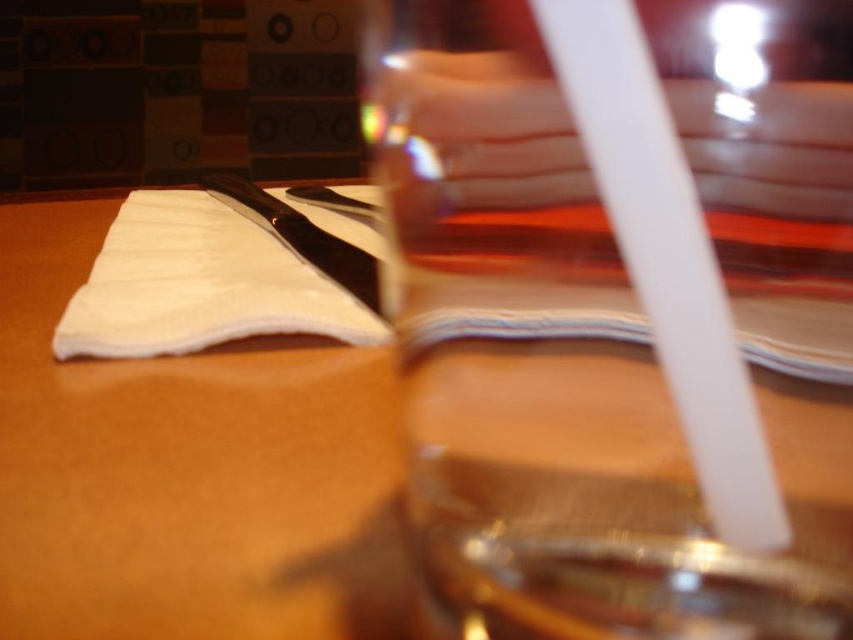
Based on the photo, does transparent glass at center appear on the left side of white fabric at center?

In fact, transparent glass at center is to the right of white fabric at center.

Which is more to the right, transparent glass at center or white fabric at center?

Positioned to the right is transparent glass at center.

Does point (543, 465) lie in front of point (242, 248)?

Yes, it is in front of point (242, 248).

Where is `transparent glass at center`? The image size is (853, 640). transparent glass at center is located at coordinates (561, 372).

Is wooden table at center positioned in front of polished metal knife at center?

Yes, wooden table at center is in front of polished metal knife at center.

Between point (18, 468) and point (280, 208), which one is positioned behind?

Positioned behind is point (280, 208).

Looking at this image, who is more distant from viewer, [178,516] or [235,177]?

The point [235,177] is behind.

Locate an element on the screen. wooden table at center is located at coordinates (189, 472).

Can you confirm if wooden table at center is positioned to the left of white fabric at center?

Indeed, wooden table at center is positioned on the left side of white fabric at center.

Which is in front, point (845, 394) or point (160, 300)?

Positioned in front is point (845, 394).

Image resolution: width=853 pixels, height=640 pixels. I want to click on wooden table at center, so click(189, 472).

Where is `wooden table at center`? wooden table at center is located at coordinates (189, 472).